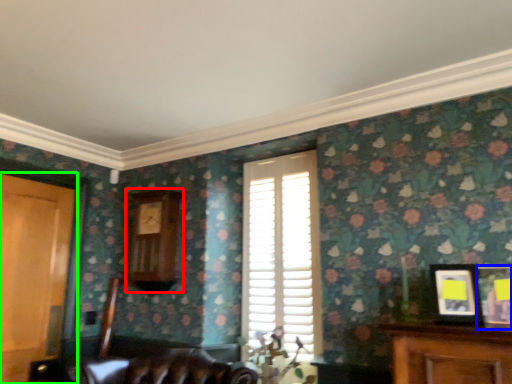
Question: Estimate the real-world distances between objects in this image. Which object is farther from clock (highlighted by a red box), picture frame (highlighted by a blue box) or door (highlighted by a green box)?

Choices:
 (A) picture frame
 (B) door

Answer: (A)